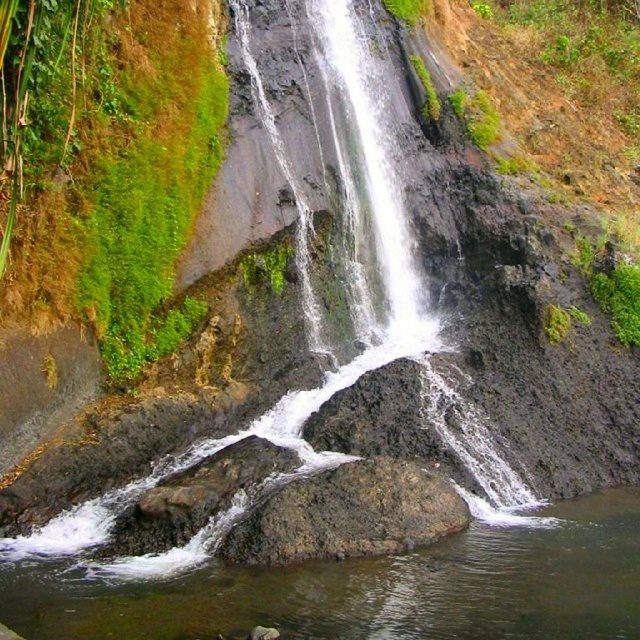
You are standing at the base of the waterfall and want to reach both the point at coordinates point (204, 115) and point (484, 563). Which point should you head towards first if you want to reach the one closer to you first?

You should head towards point (204, 115) first because it is closer to you than point (484, 563).

You are standing at the base of the waterfall and want to find the clear water at rock center. According to the coordinates provided, where should you look relative to the center of the image?

The clear water at rock center is located at coordinates point (364, 588). Since the x coordinate is 0.919, which is greater than 0.5, it is to the right of the center. The y coordinate is 0.569, slightly above the center point. Therefore, you should look to the right and slightly above the center of the image.